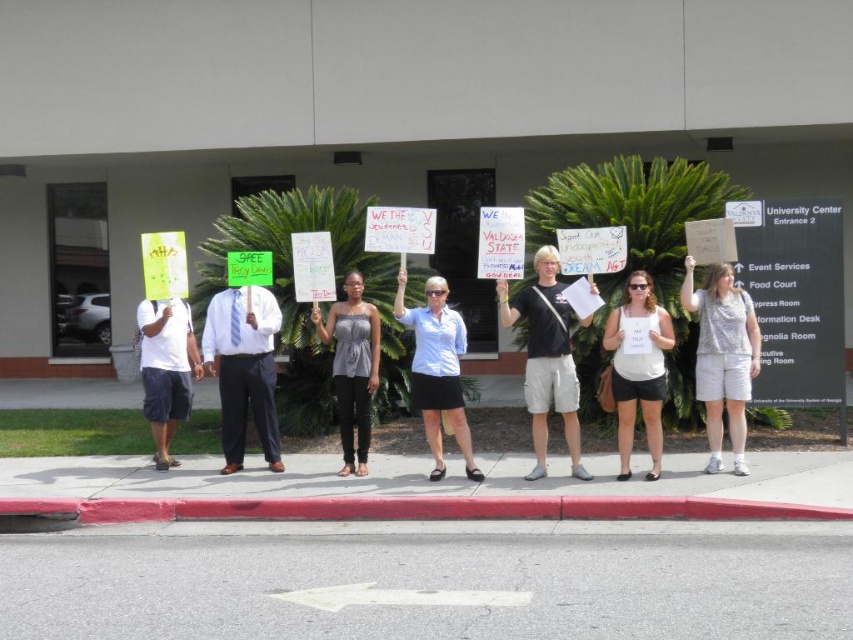
You are a photographer standing at the entrance of the University Center. You want to take a photo of the matte gray tank top at center. According to the coordinates, where should you aim your camera?

You should aim your camera at point [352,368] to capture the matte gray tank top at center.

You are a photographer standing at the entrance of the University Center. You want to take a photo of the white cotton tank top at center and the matte gray tank top at center such that both are clearly visible in the frame. Given that your camera has a minimum focus distance of 5 feet, can you position yourself to capture both individuals without moving them?

The white cotton tank top at center is 7.86 feet from the matte gray tank top at center. Since the minimum focus distance is 5 feet, you can position yourself at a distance where both are within the camera range. For example, standing 5 feet away from the closer individual would place the farther one at 5 feet plus 7.86 feet, but this might exceed the camera range. Alternatively, moving back to ensure both are within the 5 feet minimum might not be possible. Wait, perhaps the total distance between them is